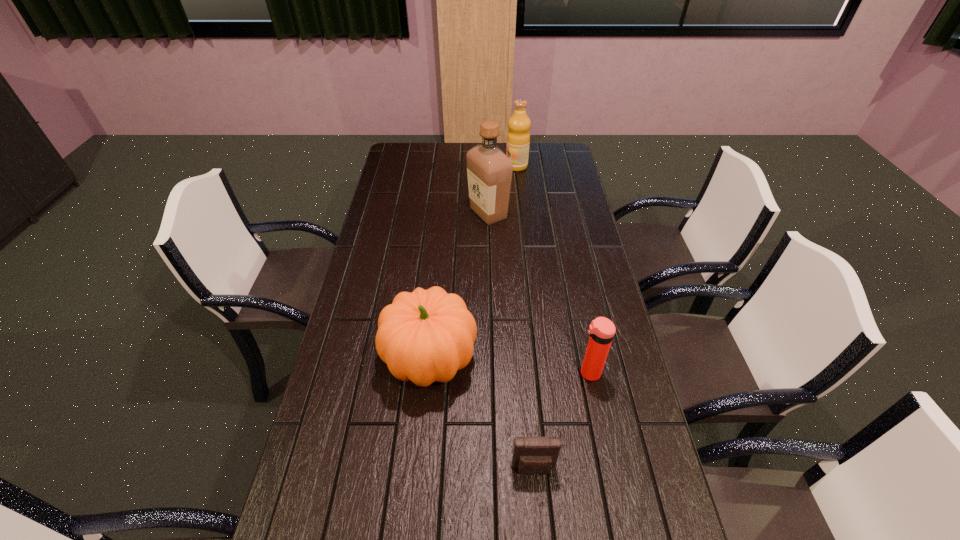
Find the location of `free location at the left edge`. free location at the left edge is located at coordinates (400, 264).

In the image, there is a desktop. Identify the location of vacant space at the right edge. This screenshot has width=960, height=540. (653, 503).

The width and height of the screenshot is (960, 540). In the image, there is a desktop. What are the coordinates of `vacant space at the far left corner` in the screenshot? It's located at 393,162.

I want to click on free point between the shortest object and the rightmost object, so click(562, 421).

This screenshot has height=540, width=960. In order to click on vacant area between the rightmost object and the pouch in this screenshot , I will do `click(562, 421)`.

The height and width of the screenshot is (540, 960). I want to click on free spot between the pumpkin and the shortest object, so click(482, 415).

Where is `free space between the shortest object and the pumpkin`? Image resolution: width=960 pixels, height=540 pixels. free space between the shortest object and the pumpkin is located at coordinates (482, 415).

This screenshot has width=960, height=540. I want to click on empty space between the liquor and the thermos bottle, so click(539, 293).

Where is `free space between the pumpkin and the second farthest object`? The image size is (960, 540). free space between the pumpkin and the second farthest object is located at coordinates (459, 287).

Find the location of a particular element. free space between the rightmost object and the farthest object is located at coordinates (553, 269).